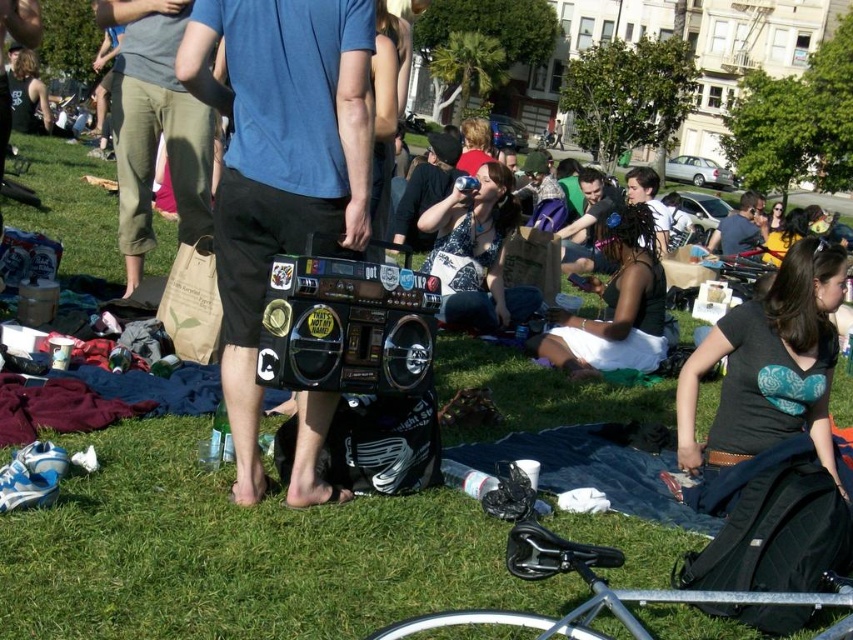
Between blue cotton shirt at center and silver metallic bicycle at lower center, which one has less height?

blue cotton shirt at center is shorter.

From the picture: Can you confirm if blue cotton shirt at center is positioned to the right of silver metallic bicycle at lower center?

No, blue cotton shirt at center is not to the right of silver metallic bicycle at lower center.

Between point (206, 138) and point (757, 602), which one is positioned in front?

Point (757, 602) is more forward.

Find the location of `blue cotton shirt at center`. blue cotton shirt at center is located at coordinates (155, 125).

Who is lower down, matte black boombox at center or shiny black boombox at center?

shiny black boombox at center is lower down.

Who is higher up, matte black boombox at center or shiny black boombox at center?

matte black boombox at center

This screenshot has height=640, width=853. Identify the location of matte black boombox at center. (279, 164).

Identify the location of matte black boombox at center. (279, 164).

Does silver metallic bicycle at lower center appear under matte black tank top at center?

Correct, silver metallic bicycle at lower center is located below matte black tank top at center.

Between silver metallic bicycle at lower center and matte black tank top at center, which one appears on the left side from the viewer's perspective?

Positioned to the left is matte black tank top at center.

This screenshot has height=640, width=853. What do you see at coordinates (595, 592) in the screenshot?
I see `silver metallic bicycle at lower center` at bounding box center [595, 592].

Identify the location of silver metallic bicycle at lower center. The width and height of the screenshot is (853, 640). (595, 592).